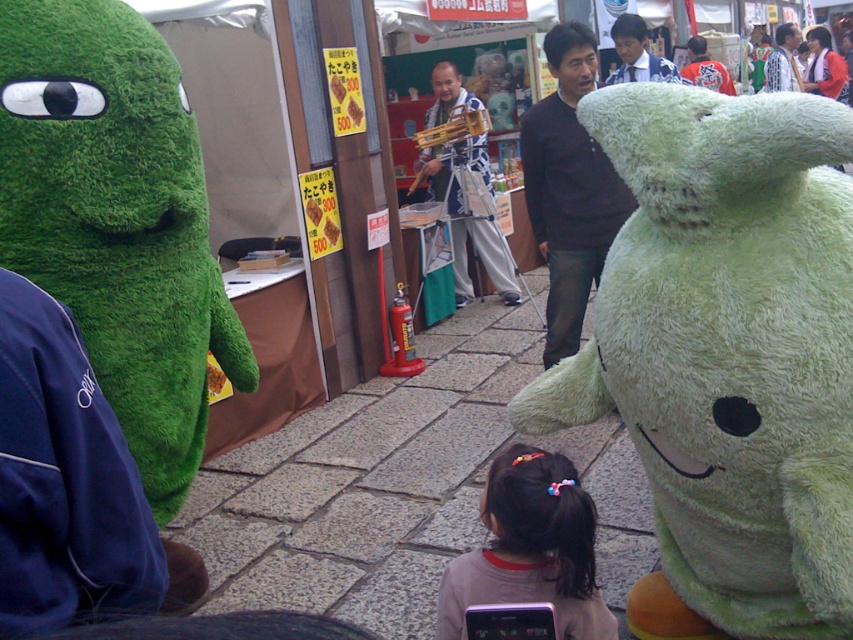
Consider the image. You are a photographer trying to capture both the dark blue sweater at center and the blue and white patterned shirt at center in a single frame. Since the sweater is wider, which object should you focus on to ensure both fit in the photo?

The dark blue sweater at center is wider than the blue and white patterned shirt at center, so you should focus on the dark blue sweater at center to ensure both fit in the photo.

You are a photographer standing in the middle of the street. You want to take a photo that includes both the fluffy green plush at left and the orange jersey at upper right. Which object should you position closer to the left side of your camera frame?

The fluffy green plush at left should be positioned closer to the left side of your camera frame since it is already on the left side of the orange jersey at upper right.

You are a photographer at the market and want to capture both the blue and white striped apron at center and the orange jersey at upper right in a single frame. Which object should you focus on to ensure both are visible without zooming in too much?

The blue and white striped apron at center occupies less space than the orange jersey at upper right, so focusing on the orange jersey at upper right would allow both to be visible without excessive zooming.